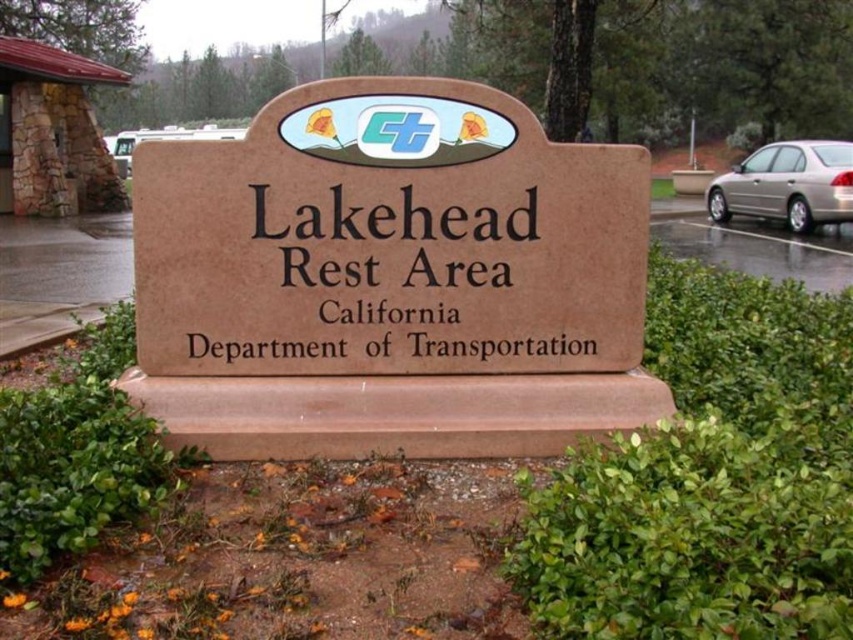
Which is behind, point (238, 371) or point (427, 104)?

The point (238, 371) is behind.

Can you confirm if brown stone sign at center is shorter than matte plastic sign at center?

No, brown stone sign at center is not shorter than matte plastic sign at center.

Who is more distant from viewer, (x=292, y=212) or (x=364, y=148)?

The point (x=292, y=212) is behind.

At what (x,y) coordinates should I click in order to perform the action: click on brown stone sign at center. Please return your answer as a coordinate pair (x, y). This screenshot has width=853, height=640. Looking at the image, I should click on (390, 282).

Can you confirm if matte plastic sign at center is shorter than matte plastic logo at center?

In fact, matte plastic sign at center may be taller than matte plastic logo at center.

Does point (442, 109) come in front of point (428, 134)?

Yes, point (442, 109) is closer to viewer.

The image size is (853, 640). What are the coordinates of `matte plastic sign at center` in the screenshot? It's located at (397, 131).

Does brown concrete sign at center have a greater height compared to matte plastic sign at center?

Yes.

Is point (827, 273) less distant than point (457, 140)?

No, (827, 273) is behind (457, 140).

Identify the location of brown concrete sign at center. (65, 259).